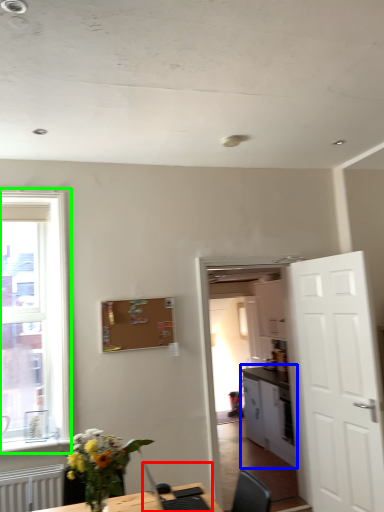
Question: Based on their relative distances, which object is farther from computer (highlighted by a red box)? Choose from cabinetry (highlighted by a blue box) and window (highlighted by a green box).

Choices:
 (A) cabinetry
 (B) window

Answer: (A)